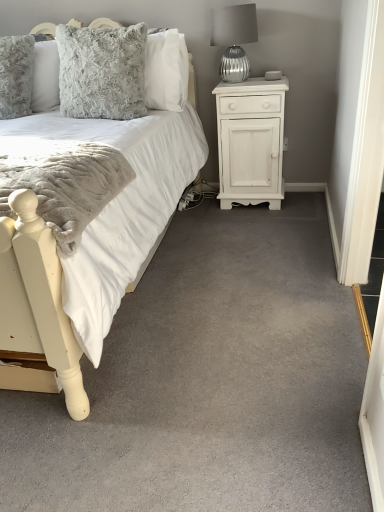
Question: Which is correct: white soft fabric bed at left is inside white soft carpet at center, or outside of it?

Choices:
 (A) inside
 (B) outside

Answer: (B)

Question: Considering the positions of point (28, 357) and point (324, 416), is point (28, 357) closer or farther from the camera than point (324, 416)?

Choices:
 (A) closer
 (B) farther

Answer: (B)

Question: Considering the real-world distances, which object is farthest from the fluffy gray pillow at upper left?

Choices:
 (A) white soft carpet at center
 (B) white painted wood nightstand at right
 (C) silver textured glass at upper right
 (D) white soft fabric bed at left

Answer: (D)

Question: Considering the real-world distances, which object is closest to the white painted wood nightstand at right?

Choices:
 (A) fluffy gray pillow at upper left
 (B) white soft fabric bed at left
 (C) silver textured glass at upper right
 (D) white soft carpet at center

Answer: (C)